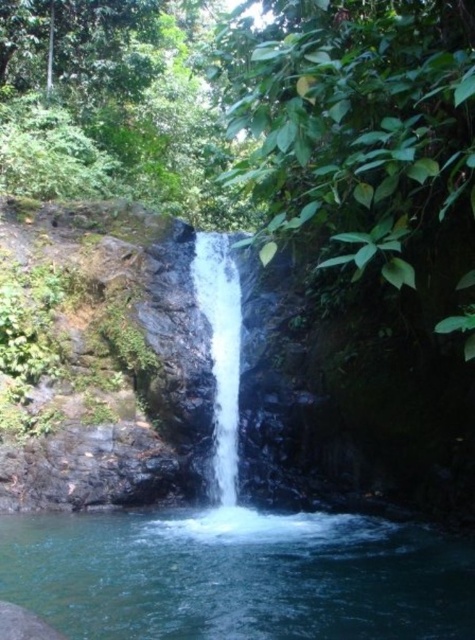
You are a photographer planning to capture the waterfall and the pool below. You want to ensure your camera can fit both the clear blue water at center and the white smooth waterfall at center in the same frame. Based on their widths, is this possible?

The clear blue water at center might be wider than the white smooth waterfall at center, so it is possible to fit both in the frame if the camera can accommodate the combined width of both elements.

You are a photographer planning to capture the waterfall and the pool below. You want to ensure that both the clear blue water at center and the white smooth waterfall at center are visible in your shot. Based on their sizes, which one should you focus on to ensure it fits within the frame?

The clear blue water at center is not as tall as the white smooth waterfall at center, so you should focus on capturing the white smooth waterfall at center first as it is taller and might require more space in the frame.